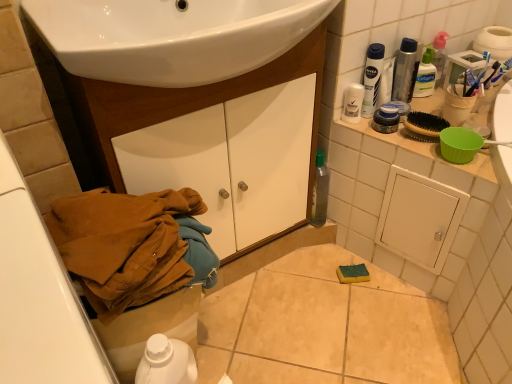
Question: Is white plastic bottle at upper right, placed as the second mouthwash when sorted from bottom to top, in front of or behind metallic silver spray can at upper right in the image?

Choices:
 (A) behind
 (B) front

Answer: (B)

Question: From the image's perspective, is white plastic bottle at upper right, placed as the second mouthwash when sorted from bottom to top, above or below metallic silver spray can at upper right?

Choices:
 (A) below
 (B) above

Answer: (A)

Question: Which object is the farthest from the white plastic toilet bowl at lower left?

Choices:
 (A) metallic silver spray can at upper right
 (B) translucent plastic pump bottle at upper right
 (C) white plastic bottle at upper right, which ranks as the 1th mouthwash in top-to-bottom order
 (D) clear plastic bottle at upper right, marked as the second toiletry in a front-to-back arrangement
 (E) wooden cabinet at lower left

Answer: (B)

Question: Which is nearer to the white plastic toilet bowl at lower left?

Choices:
 (A) white matte deodorant stick at upper right, the 2th toiletry when ordered from back to front
 (B) wooden cabinet at lower left
 (C) translucent plastic pump bottle at upper right
 (D) clear plastic bottle at upper right, marked as the second toiletry in a front-to-back arrangement
 (E) blue plastic toothbrush at upper right

Answer: (B)